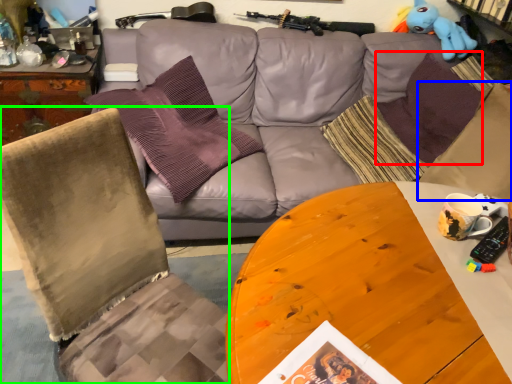
Question: Which object is the farthest from pillow (highlighted by a red box)? Choose among these: pillow (highlighted by a blue box) or chair (highlighted by a green box).

Choices:
 (A) pillow
 (B) chair

Answer: (B)